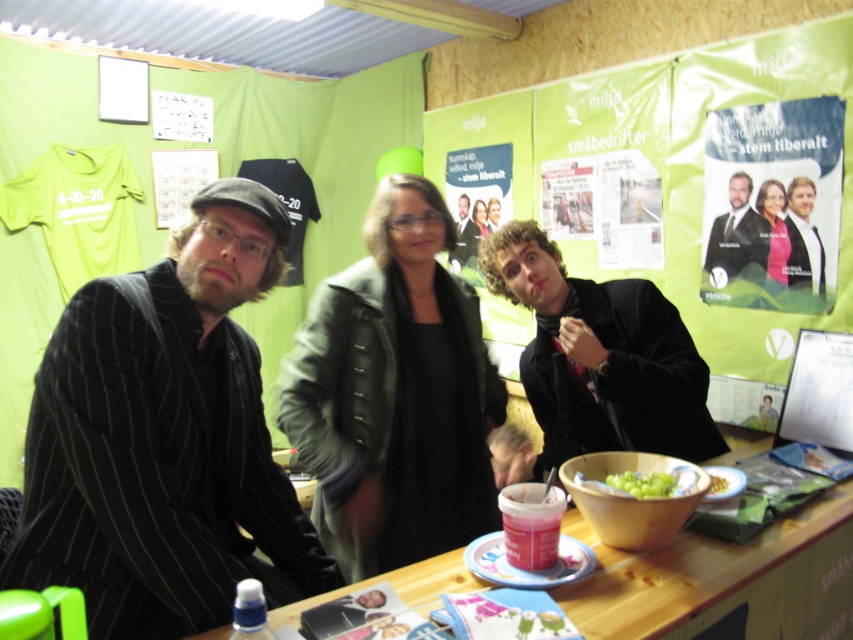
You are setting up a campaign booth and need to place a banner on the wooden table at lower center. Based on the coordinates provided in the Objects Description, is the table positioned closer to the right or left side of the image?

The wooden table at lower center is located at point (723, 579). Since the x coordinate is 0.906, which is closer to 1.0, the table is positioned closer to the right side of the image.

You are attending a political event and want to approach the person in the black pinstripe suit at left and the matte black jacket at center. Which individual should you approach first based on their proximity to you?

You should approach the black pinstripe suit at left first since it is closer to you than the matte black jacket at center.